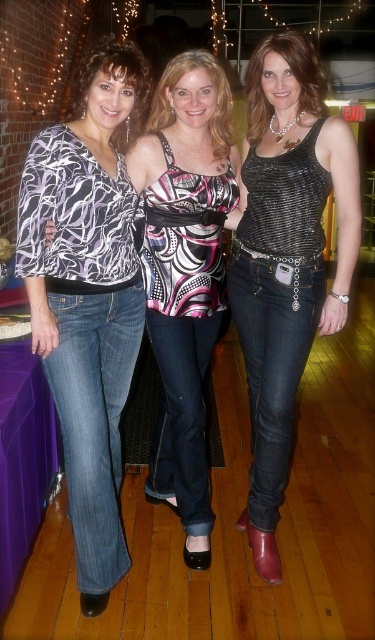
Is printed jersey top at left above sparkly metallic tank top at center?

No.

Between printed jersey top at left and sparkly metallic tank top at center, which one appears on the left side from the viewer's perspective?

printed jersey top at left

Who is more forward, [72,305] or [264,196]?

Point [72,305]

Find the location of a particular element. Image resolution: width=375 pixels, height=640 pixels. printed jersey top at left is located at coordinates (88, 298).

Does point (288, 349) come behind point (223, 289)?

No.

Can you confirm if sparkly metallic tank top at center is positioned to the right of matte black top at center?

Correct, you'll find sparkly metallic tank top at center to the right of matte black top at center.

Looking at this image, who is more forward, (x=274, y=547) or (x=186, y=264)?

Point (x=186, y=264) is more forward.

I want to click on sparkly metallic tank top at center, so click(286, 259).

Consider the image. Who is taller, printed jersey top at left or sparkly silver tank top at center?

printed jersey top at left

Based on the photo, is printed jersey top at left taller than sparkly silver tank top at center?

Yes, printed jersey top at left is taller than sparkly silver tank top at center.

Between point (106, 468) and point (319, 84), which one is positioned behind?

Point (319, 84)

Image resolution: width=375 pixels, height=640 pixels. Identify the location of printed jersey top at left. (88, 298).